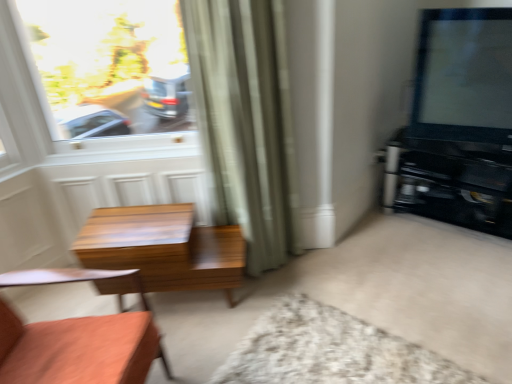
Question: Are clear glass window at upper left and white shaggy rug at lower center making contact?

Choices:
 (A) no
 (B) yes

Answer: (A)

Question: Is clear glass window at upper left wider than white shaggy rug at lower center?

Choices:
 (A) yes
 (B) no

Answer: (B)

Question: Considering the relative positions of clear glass window at upper left and white shaggy rug at lower center in the image provided, is clear glass window at upper left to the left of white shaggy rug at lower center from the viewer's perspective?

Choices:
 (A) yes
 (B) no

Answer: (A)

Question: Is clear glass window at upper left positioned beyond the bounds of white shaggy rug at lower center?

Choices:
 (A) yes
 (B) no

Answer: (A)

Question: Is clear glass window at upper left taller than white shaggy rug at lower center?

Choices:
 (A) yes
 (B) no

Answer: (A)

Question: Is black glossy entertainment center at right bigger or smaller than wooden chair at lower left?

Choices:
 (A) big
 (B) small

Answer: (B)

Question: Is point (510, 165) positioned closer to the camera than point (20, 354)?

Choices:
 (A) farther
 (B) closer

Answer: (A)

Question: From their relative heights in the image, would you say black glossy entertainment center at right is taller or shorter than wooden chair at lower left?

Choices:
 (A) tall
 (B) short

Answer: (B)

Question: Is black glossy entertainment center at right to the left or to the right of wooden chair at lower left in the image?

Choices:
 (A) right
 (B) left

Answer: (A)

Question: Relative to green fabric curtain at center, is white shaggy rug at lower center in front or behind?

Choices:
 (A) behind
 (B) front

Answer: (B)

Question: From a real-world perspective, relative to green fabric curtain at center, is white shaggy rug at lower center vertically above or below?

Choices:
 (A) below
 (B) above

Answer: (A)

Question: From the image's perspective, is white shaggy rug at lower center located above or below green fabric curtain at center?

Choices:
 (A) above
 (B) below

Answer: (B)

Question: Is white shaggy rug at lower center bigger or smaller than green fabric curtain at center?

Choices:
 (A) big
 (B) small

Answer: (B)

Question: Considering the positions of matte black tv at upper right and white shaggy rug at lower center in the image, is matte black tv at upper right wider or thinner than white shaggy rug at lower center?

Choices:
 (A) wide
 (B) thin

Answer: (B)

Question: In the image, is matte black tv at upper right positioned in front of or behind white shaggy rug at lower center?

Choices:
 (A) behind
 (B) front

Answer: (A)